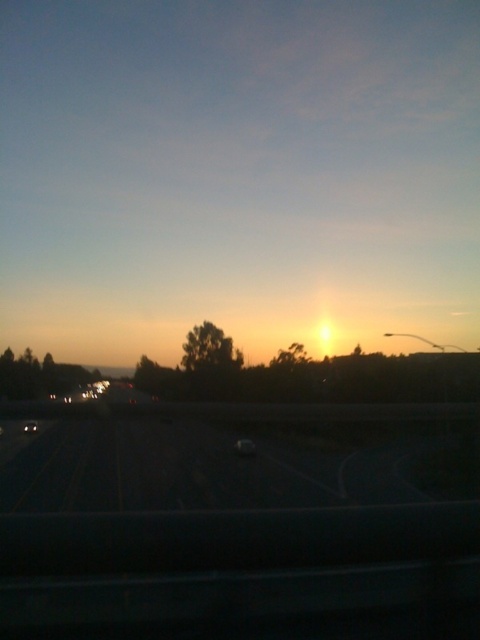
Is yellow asphalt highway at lower center smaller than matte white car at center?

Actually, yellow asphalt highway at lower center might be larger than matte white car at center.

Which is below, yellow asphalt highway at lower center or matte white car at center?

matte white car at center is below.

Find the location of `yellow asphalt highway at lower center`. yellow asphalt highway at lower center is located at coordinates (232, 465).

Between point (383, 424) and point (243, 440), which one is positioned behind?

The point (383, 424) is more distant.

Does yellow asphalt highway at lower center have a smaller size compared to shiny black car at center?

No.

What do you see at coordinates (232, 465) in the screenshot? I see `yellow asphalt highway at lower center` at bounding box center [232, 465].

The height and width of the screenshot is (640, 480). I want to click on yellow asphalt highway at lower center, so click(232, 465).

Between shiny black car at center and matte white car at center, which one appears on the left side from the viewer's perspective?

From the viewer's perspective, matte white car at center appears more on the left side.

Who is taller, shiny black car at center or matte white car at center?

shiny black car at center is taller.

Is point (237, 442) behind point (31, 422)?

Yes, point (237, 442) is behind point (31, 422).

Where is `shiny black car at center`? The width and height of the screenshot is (480, 640). shiny black car at center is located at coordinates (244, 448).